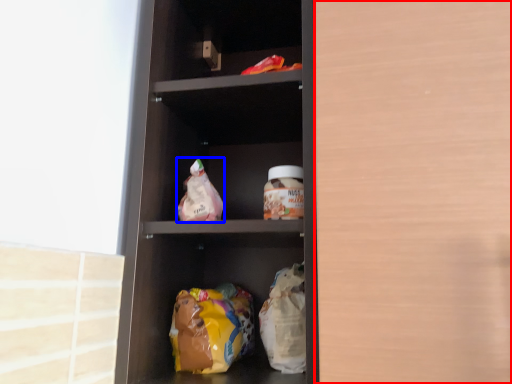
Question: Which object appears closest to the camera in this image, glass door (highlighted by a red box) or snack (highlighted by a blue box)?

Choices:
 (A) glass door
 (B) snack

Answer: (A)